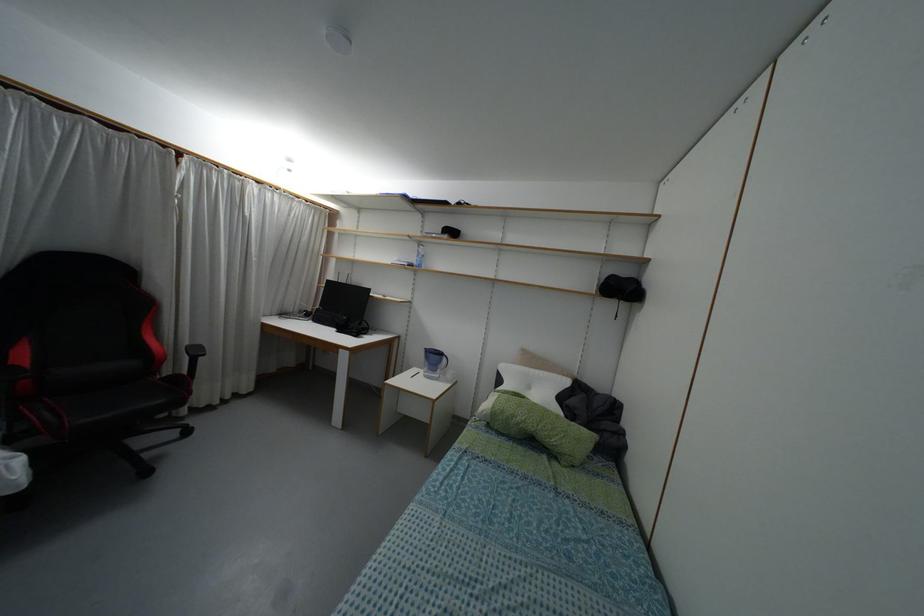
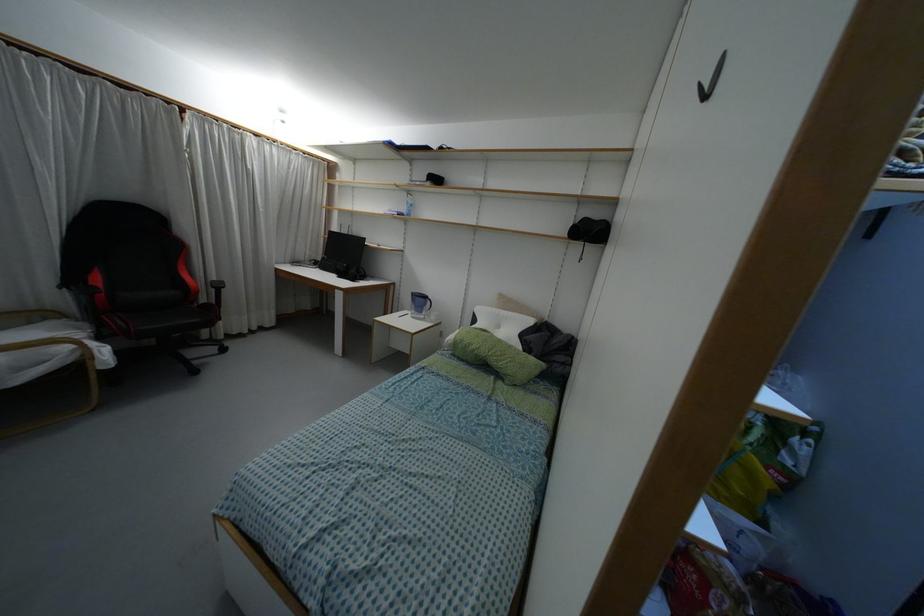
Locate, in the second image, the point that corresponds to pixel 492 407 in the first image.

(455, 337)